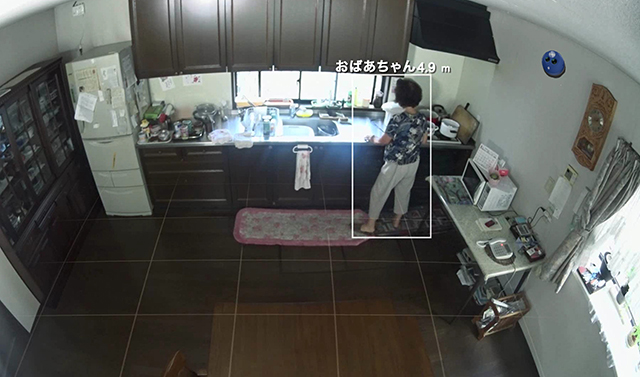
The width and height of the screenshot is (640, 377). What are the coordinates of `cabinets` in the screenshot? It's located at (288, 30), (250, 20), (203, 25), (141, 20), (342, 40), (381, 39).